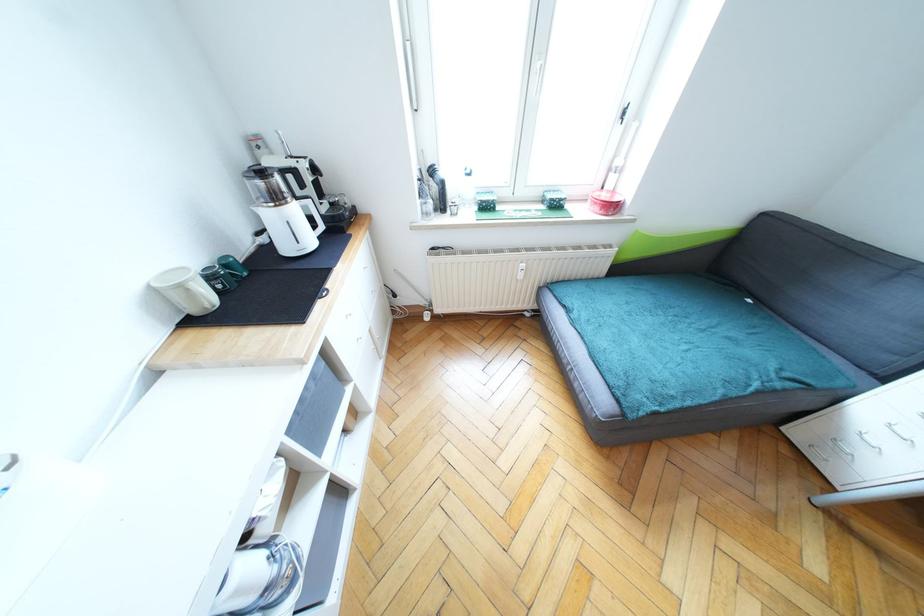
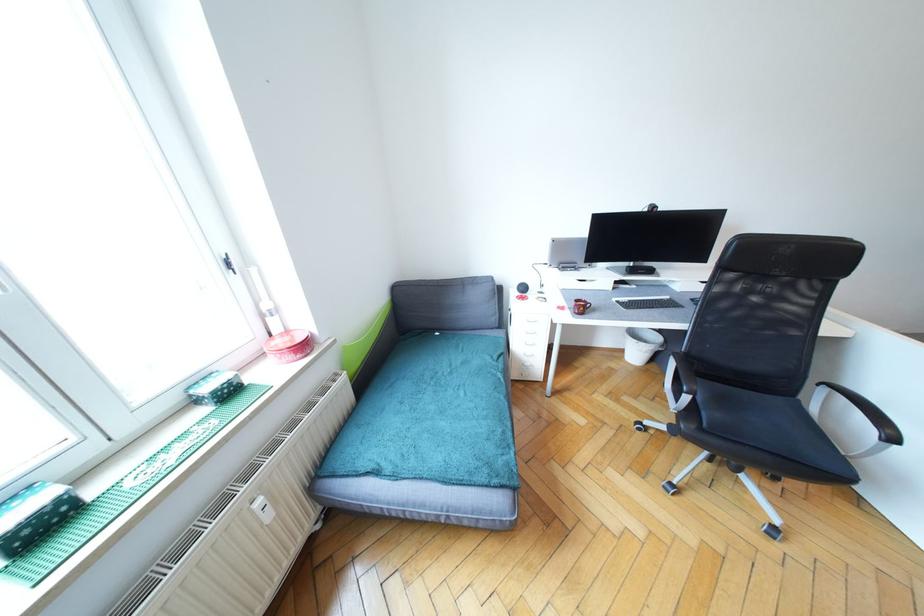
Find the pixel in the second image that matches the point at 554,201 in the first image.

(217, 392)